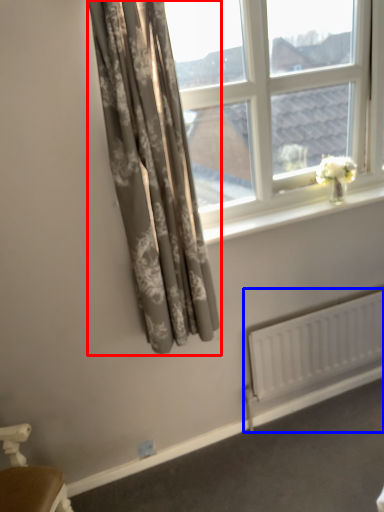
Question: Among these objects, which one is farthest to the camera, curtain (highlighted by a red box) or radiator (highlighted by a blue box)?

Choices:
 (A) curtain
 (B) radiator

Answer: (B)